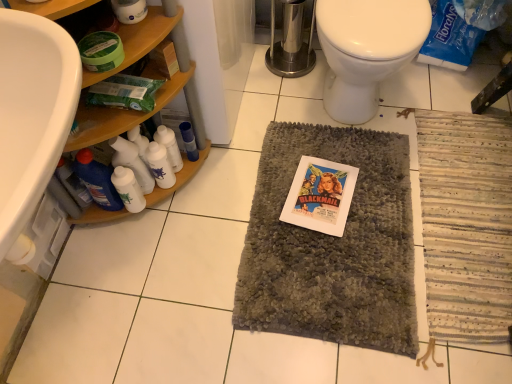
The image size is (512, 384). In order to click on vacant area that lies in front of white plastic bottles at left, placed as the fourth bottle when sorted from left to right in this screenshot , I will do pos(181,215).